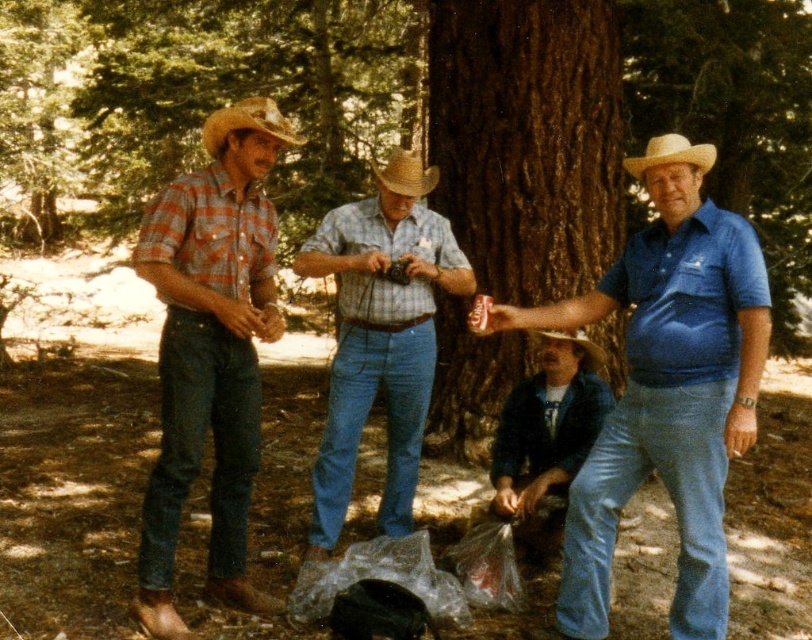
You are standing in the forest and want to walk from point A to point B. Point A is at coordinates point (x=546, y=195) and point B is at coordinates point (x=379, y=170). Which point is closer to you when you start walking?

Point A at coordinates point (x=546, y=195) is closer to you because it is further to the viewer than point B at coordinates point (x=379, y=170).

You are trying to decide which item to pack first in your backpack. The denim jeans at center and the rustic straw cowboy hat at upper left are both on the ground. Based on their sizes, which one should you pick up first if you want to maximize space efficiency?

The rustic straw cowboy hat at upper left is smaller than the denim jeans at center, so you should pick up the rustic straw cowboy hat at upper left first to maximize space efficiency.